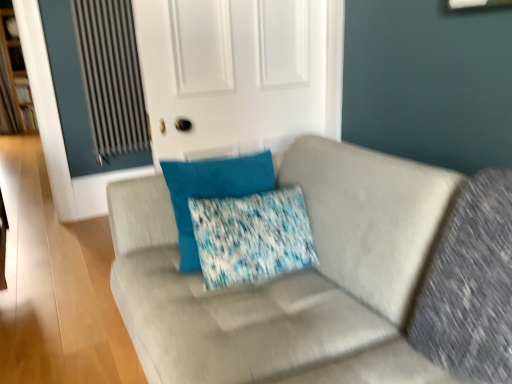
Question: Is blue textured pillow at center closer to camera compared to blue fabric pillow at center?

Choices:
 (A) yes
 (B) no

Answer: (A)

Question: Considering the relative positions of blue textured pillow at center and blue fabric pillow at center in the image provided, is blue textured pillow at center behind blue fabric pillow at center?

Choices:
 (A) yes
 (B) no

Answer: (B)

Question: Considering the relative sizes of blue textured pillow at center and blue fabric pillow at center in the image provided, is blue textured pillow at center wider than blue fabric pillow at center?

Choices:
 (A) yes
 (B) no

Answer: (B)

Question: Is blue textured pillow at center not near blue fabric pillow at center?

Choices:
 (A) yes
 (B) no

Answer: (B)

Question: Is blue textured pillow at center not inside blue fabric pillow at center?

Choices:
 (A) no
 (B) yes

Answer: (A)

Question: Is blue textured pillow at center smaller than blue fabric pillow at center?

Choices:
 (A) yes
 (B) no

Answer: (A)

Question: Is suede gray couch at center outside of blue fabric pillow at center?

Choices:
 (A) no
 (B) yes

Answer: (B)

Question: Is suede gray couch at center in contact with blue fabric pillow at center?

Choices:
 (A) no
 (B) yes

Answer: (A)

Question: Does suede gray couch at center have a lesser height compared to blue fabric pillow at center?

Choices:
 (A) no
 (B) yes

Answer: (A)

Question: Is suede gray couch at center surrounding blue fabric pillow at center?

Choices:
 (A) no
 (B) yes

Answer: (B)

Question: From the image's perspective, is suede gray couch at center above blue fabric pillow at center?

Choices:
 (A) no
 (B) yes

Answer: (A)

Question: Is suede gray couch at center turned away from blue fabric pillow at center?

Choices:
 (A) no
 (B) yes

Answer: (A)

Question: Is suede gray couch at center completely or partially inside white matte door at upper center?

Choices:
 (A) yes
 (B) no

Answer: (B)